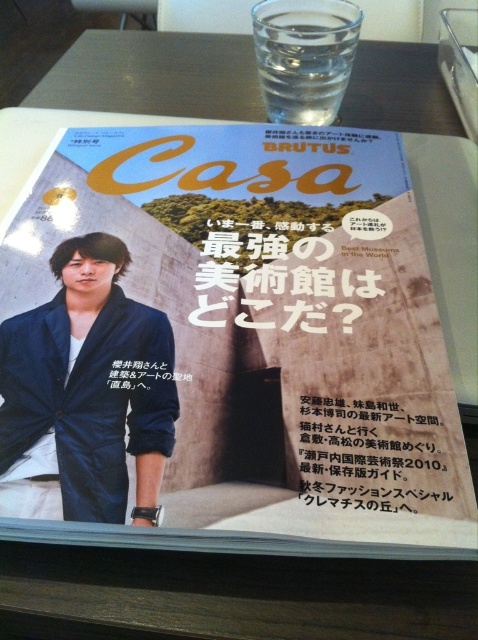
Does satin blue blazer at left appear on the left side of black paper at center?

Yes, satin blue blazer at left is to the left of black paper at center.

Can you confirm if satin blue blazer at left is smaller than black paper at center?

No, satin blue blazer at left is not smaller than black paper at center.

This screenshot has height=640, width=478. What do you see at coordinates (88, 387) in the screenshot? I see `satin blue blazer at left` at bounding box center [88, 387].

Identify the location of satin blue blazer at left. The width and height of the screenshot is (478, 640). (88, 387).

Does point (195, 432) come closer to viewer compared to point (83, 346)?

Yes.

Who is taller, blue fabric magazine at center or satin blue blazer at left?

blue fabric magazine at center is taller.

Identify the location of blue fabric magazine at center. (265, 332).

Find the location of a particular element. This screenshot has width=478, height=640. blue fabric magazine at center is located at coordinates (265, 332).

Between blue fabric magazine at center and black paper at center, which one appears on the right side from the viewer's perspective?

From the viewer's perspective, black paper at center appears more on the right side.

Does point (394, 252) come closer to viewer compared to point (354, 490)?

That is False.

Find the location of a particular element. Image resolution: width=478 pixels, height=640 pixels. blue fabric magazine at center is located at coordinates (265, 332).